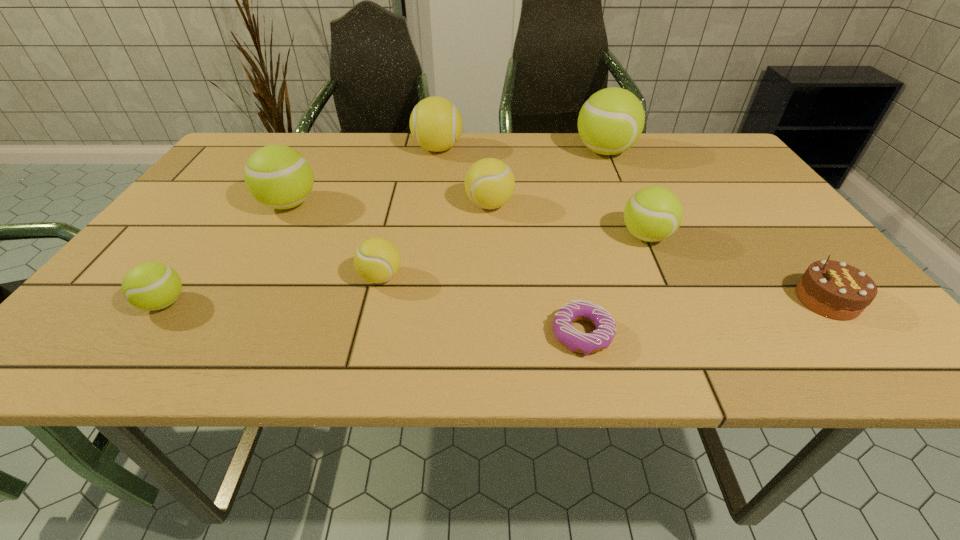
The width and height of the screenshot is (960, 540). I want to click on yellow tennis ball that can be found as the second closest to the brown chocolate cake, so click(377, 260).

Identify the location of free spot that satisfies the following two spatial constraints: 1. on the back side of the second biggest green tennis ball; 2. on the right side of the smallest green tennis ball. (235, 204).

At what (x,y) coordinates should I click in order to perform the action: click on free space in the image that satisfies the following two spatial constraints: 1. on the back side of the doughnut; 2. on the right side of the brown chocolate cake. Please return your answer as a coordinate pair (x, y). Looking at the image, I should click on pos(575,300).

This screenshot has width=960, height=540. I want to click on vacant space that satisfies the following two spatial constraints: 1. on the back side of the purple doughnut; 2. on the right side of the biggest green tennis ball, so click(542, 152).